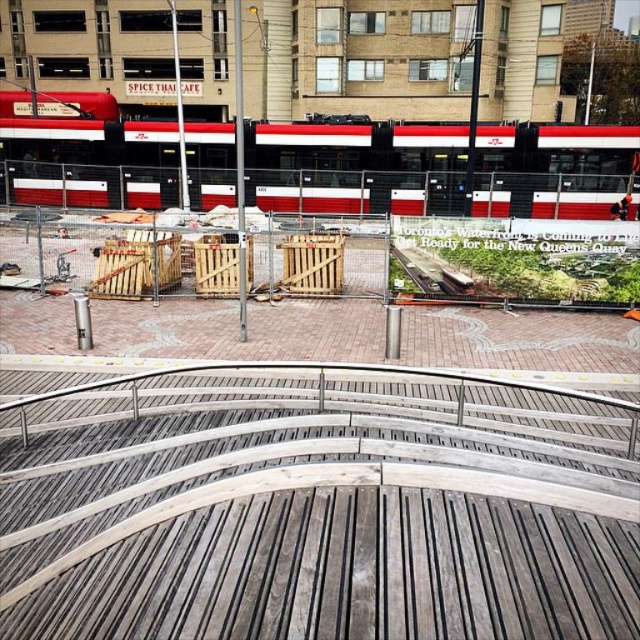
Identify the location of wooden crates at center. The height and width of the screenshot is (640, 640). (314, 500).

Is wooden crates at center shorter than red and white metal passenger train at upper center?

Yes, wooden crates at center is shorter than red and white metal passenger train at upper center.

Who is more distant from viewer, (44,598) or (282,156)?

Positioned behind is point (282,156).

Identify the location of wooden crates at center. This screenshot has width=640, height=640. (314, 500).